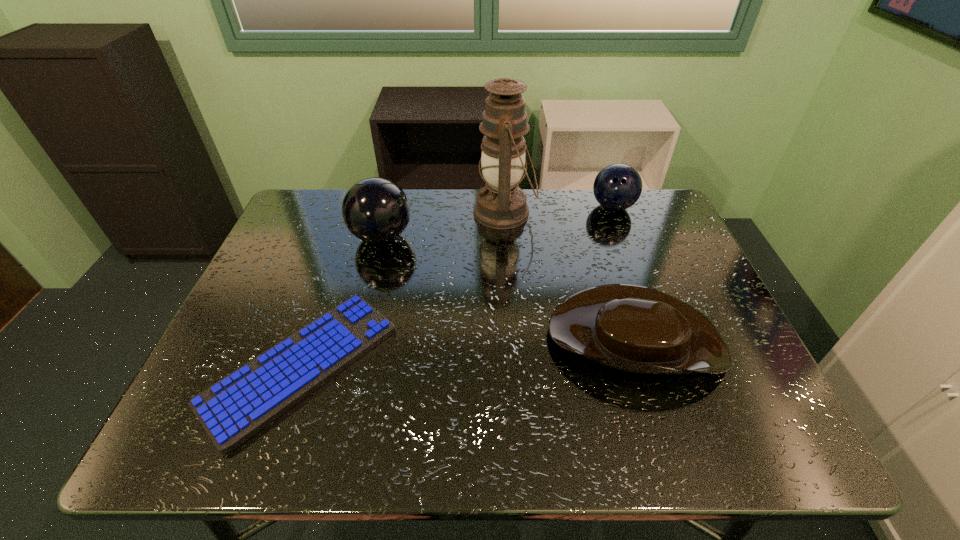
The image size is (960, 540). What are the coordinates of `vacant area between the cowboy hat and the tallest object` in the screenshot? It's located at (569, 273).

At what (x,y) coordinates should I click in order to perform the action: click on vacant region between the oil lamp and the computer keyboard. Please return your answer as a coordinate pair (x, y). The height and width of the screenshot is (540, 960). Looking at the image, I should click on (403, 289).

Where is `the third closest object to the second tallest object`? The image size is (960, 540). the third closest object to the second tallest object is located at coordinates (631, 328).

Locate an element on the screen. object identified as the third closest to the left bowling ball is located at coordinates [x=631, y=328].

This screenshot has width=960, height=540. What are the coordinates of `vacant space that satisfies the following two spatial constraints: 1. on the surface of the third shortest object near the finger holes; 2. on the side of the fourth shortest object with the finger holes` in the screenshot? It's located at (624, 237).

You are a GUI agent. You are given a task and a screenshot of the screen. Output one action in this format:
    pyautogui.click(x=<x>, y=<y>)
    Task: Click on the free space in the image that satisfies the following two spatial constraints: 1. on the back side of the tallest object; 2. on the right side of the computer keyboard
    This screenshot has width=960, height=540.
    Given the screenshot: What is the action you would take?
    pyautogui.click(x=354, y=213)